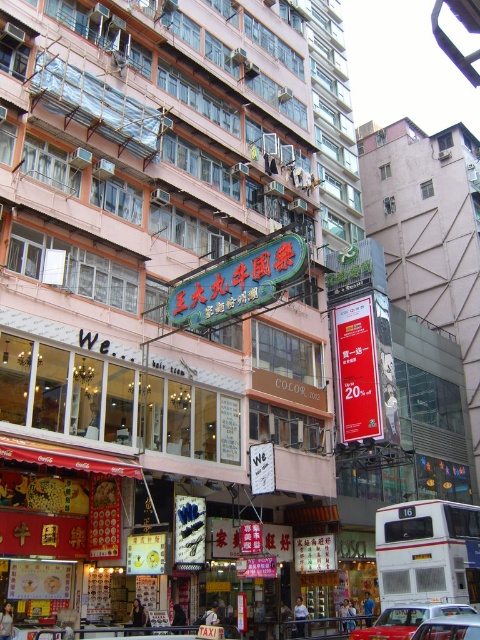
Can you confirm if white metallic bus at lower right is positioned to the right of red paper sign at center?

Correct, you'll find white metallic bus at lower right to the right of red paper sign at center.

Image resolution: width=480 pixels, height=640 pixels. What do you see at coordinates (428, 552) in the screenshot?
I see `white metallic bus at lower right` at bounding box center [428, 552].

Between point (432, 550) and point (352, 392), which one is positioned in front?

Point (432, 550) is more forward.

The width and height of the screenshot is (480, 640). In order to click on white metallic bus at lower right in this screenshot , I will do `click(428, 552)`.

Is point (377, 620) closer to viewer compared to point (414, 632)?

No, (377, 620) is further to viewer.

Measure the distance from shiny red car at lower center to metallic silver car at center.

4.39 meters

At what (x,y) coordinates should I click in order to perform the action: click on shiny red car at lower center. Please return your answer as a coordinate pair (x, y). Looking at the image, I should click on (407, 620).

Who is more distant from viewer, (402, 547) or (420, 630)?

The point (402, 547) is more distant.

Is the position of white metallic bus at lower right more distant than that of metallic silver car at center?

Yes.

Does point (437, 534) lie in front of point (431, 636)?

No, it is behind (431, 636).

Locate an element on the screen. white metallic bus at lower right is located at coordinates click(428, 552).